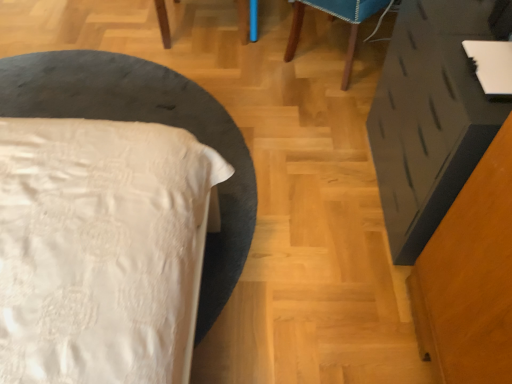
I want to click on white satin bed at left, so click(x=101, y=249).

At what (x,y) coordinates should I click in order to perform the action: click on white satin bed at left. Please return your answer as a coordinate pair (x, y). Looking at the image, I should click on (101, 249).

Consider the image. Considering the sizes of objects wooden chair at upper center and matte black vanity at right in the image provided, who is smaller, wooden chair at upper center or matte black vanity at right?

matte black vanity at right is smaller.

Considering the positions of objects wooden chair at upper center and matte black vanity at right in the image provided, who is behind, wooden chair at upper center or matte black vanity at right?

wooden chair at upper center is behind.

Between wooden chair at upper center and matte black vanity at right, which one appears on the left side from the viewer's perspective?

From the viewer's perspective, wooden chair at upper center appears more on the left side.

Would you say wooden chair at upper center is inside or outside matte black vanity at right?

wooden chair at upper center exists outside the volume of matte black vanity at right.

Which is closer, (173, 259) or (445, 175)?

Point (173, 259) is positioned closer to the camera compared to point (445, 175).

In the scene shown: Are white satin bed at left and matte black vanity at right making contact?

No, white satin bed at left is not making contact with matte black vanity at right.

Would you say matte black vanity at right is part of white satin bed at left's contents?

No.

From a real-world perspective, is white satin bed at left physically located above or below matte black vanity at right?

Clearly, from a real-world perspective, white satin bed at left is below matte black vanity at right.

Who is shorter, white satin bed at left or wooden chair at upper center?

white satin bed at left.

Between white satin bed at left and wooden chair at upper center, which one appears on the left side from the viewer's perspective?

white satin bed at left is more to the left.

From the image's perspective, which is above, white satin bed at left or wooden chair at upper center?

From the image's view, wooden chair at upper center is above.

Can you confirm if white satin bed at left is smaller than wooden chair at upper center?

Yes.

Measure the distance from matte black vanity at right to wooden chair at upper center.

matte black vanity at right and wooden chair at upper center are 70.74 centimeters apart.

From the image's perspective, is matte black vanity at right under wooden chair at upper center?

Correct, matte black vanity at right appears lower than wooden chair at upper center in the image.

Can you tell me how much matte black vanity at right and wooden chair at upper center differ in facing direction?

They differ by 132 degrees in their facing directions.

Is matte black vanity at right to the left or to the right of wooden chair at upper center in the image?

Clearly, matte black vanity at right is on the right of wooden chair at upper center in the image.

From the image's perspective, is matte black vanity at right on white satin bed at left?

No, from the image's perspective, matte black vanity at right is not on top of white satin bed at left.

Considering the positions of point (431, 81) and point (92, 359), is point (431, 81) closer or farther from the camera than point (92, 359)?

Point (431, 81) is farther from the camera than point (92, 359).

What's the angular difference between matte black vanity at right and white satin bed at left's facing directions?

0.219 degrees.

Which of these two, matte black vanity at right or white satin bed at left, is thinner?

Thinner between the two is matte black vanity at right.

Is there a large distance between wooden chair at upper center and white satin bed at left?

Yes, wooden chair at upper center is far from white satin bed at left.

In the scene shown: Could you tell me if wooden chair at upper center is turned towards white satin bed at left?

No.

Looking at this image, from the image's perspective, which one is positioned lower, wooden chair at upper center or white satin bed at left?

white satin bed at left, from the image's perspective.

Can you confirm if wooden chair at upper center is thinner than white satin bed at left?

Yes, wooden chair at upper center is thinner than white satin bed at left.

Where is `furniture to the left of matte black vanity at right`? This screenshot has width=512, height=384. furniture to the left of matte black vanity at right is located at coordinates (339, 18).

Find the location of a particular element. This screenshot has width=512, height=384. bed directly beneath the matte black vanity at right (from a real-world perspective) is located at coordinates (101, 249).

Looking at the image, which one is located closer to matte black vanity at right, wooden chair at upper center or white satin bed at left?

wooden chair at upper center is closer to matte black vanity at right.

Based on their spatial positions, is white satin bed at left or matte black vanity at right closer to wooden chair at upper center?

Based on the image, matte black vanity at right appears to be nearer to wooden chair at upper center.

Based on their spatial positions, is matte black vanity at right or wooden chair at upper center further from white satin bed at left?

wooden chair at upper center is positioned further to the anchor white satin bed at left.

Which object lies nearer to the anchor point matte black vanity at right, white satin bed at left or wooden chair at upper center?

wooden chair at upper center lies closer to matte black vanity at right than the other object.

Looking at the image, which one is located further to white satin bed at left, wooden chair at upper center or matte black vanity at right?

Based on the image, wooden chair at upper center appears to be further to white satin bed at left.

Which object lies further to the anchor point wooden chair at upper center, matte black vanity at right or white satin bed at left?

The object further to wooden chair at upper center is white satin bed at left.

This screenshot has width=512, height=384. I want to click on furniture located between white satin bed at left and matte black vanity at right in the left-right direction, so click(x=339, y=18).